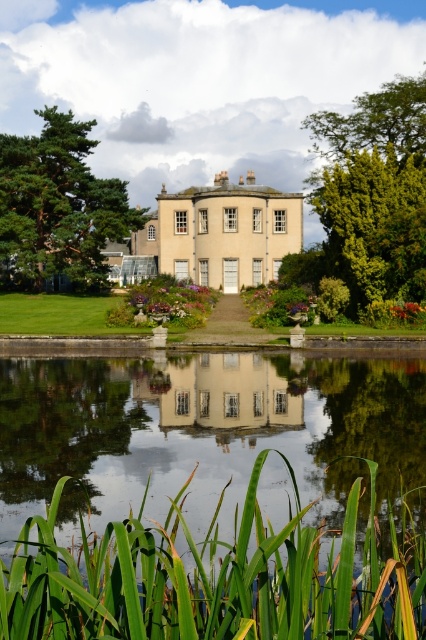
Question: Which object is the farthest from the green leafy grass at lower center?

Choices:
 (A) green leafy tree at upper right
 (B) white glossy house at center
 (C) green needle-like tree at left
 (D) transparent glass water at center

Answer: (C)

Question: Observing the image, what is the correct spatial positioning of transparent glass water at center in reference to green leafy grass at lower center?

Choices:
 (A) right
 (B) left

Answer: (B)

Question: Which object is the closest to the green leafy tree at upper right?

Choices:
 (A) transparent glass water at center
 (B) white glossy house at center
 (C) green leafy grass at lower center
 (D) green needle-like tree at left

Answer: (B)

Question: Based on their relative distances, which object is nearer to the white glossy house at center?

Choices:
 (A) transparent glass water at center
 (B) green leafy grass at lower center
 (C) green leafy tree at upper right
 (D) green needle-like tree at left

Answer: (A)

Question: Can you confirm if green leafy grass at lower center is positioned to the right of green leafy tree at upper right?

Choices:
 (A) yes
 (B) no

Answer: (B)

Question: Can you confirm if transparent glass water at center is smaller than white glossy house at center?

Choices:
 (A) yes
 (B) no

Answer: (B)